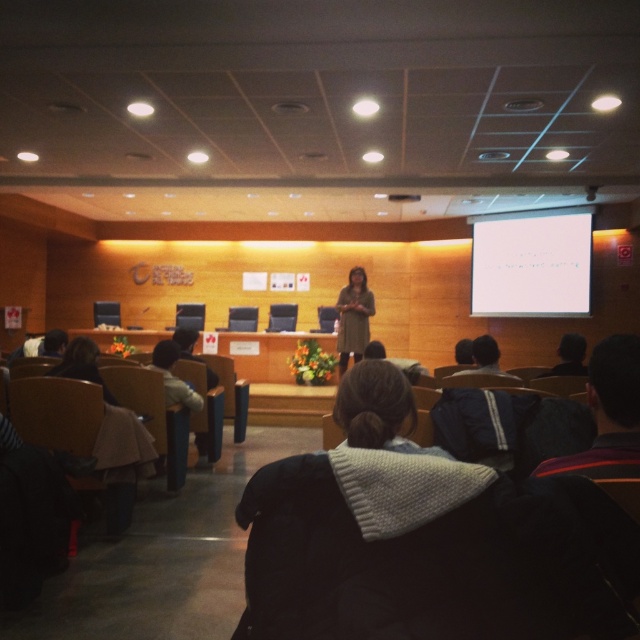
Which is behind, point (561, 285) or point (232, 326)?

Point (232, 326)

Between white matte projection screen at upper center and smooth black chair at center, which one has more height?

Standing taller between the two is white matte projection screen at upper center.

Identify the location of white matte projection screen at upper center. This screenshot has height=640, width=640. (531, 262).

Which is in front, point (509, 296) or point (360, 353)?

Point (360, 353)

The width and height of the screenshot is (640, 640). What do you see at coordinates (531, 262) in the screenshot? I see `white matte projection screen at upper center` at bounding box center [531, 262].

Identify the location of white matte projection screen at upper center. (531, 262).

Is wooden chair at center closer to the viewer compared to smooth black chair at center?

No, wooden chair at center is behind smooth black chair at center.

In the scene shown: Is wooden chair at center smaller than smooth black chair at center?

Yes, wooden chair at center is smaller than smooth black chair at center.

Describe the element at coordinates (282, 317) in the screenshot. I see `wooden chair at center` at that location.

This screenshot has height=640, width=640. I want to click on wooden chair at center, so click(x=282, y=317).